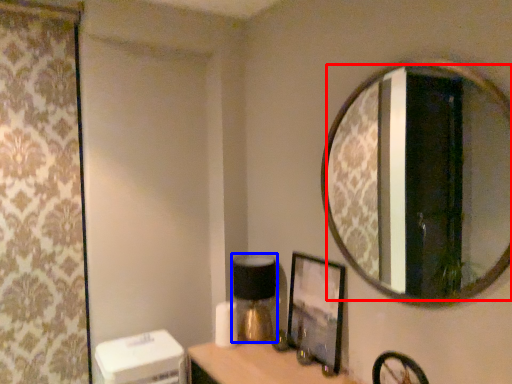
Question: Among these objects, which one is nearest to the camera, mirror (highlighted by a red box) or table lamp (highlighted by a blue box)?

Choices:
 (A) mirror
 (B) table lamp

Answer: (A)